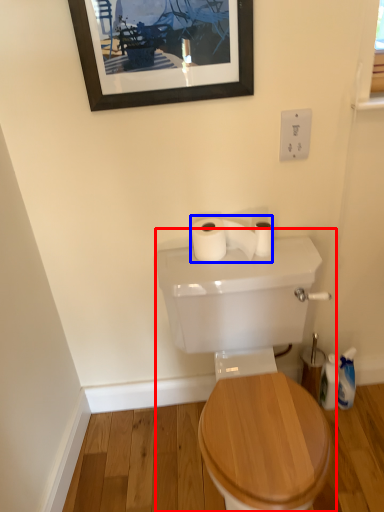
Question: Which object appears closest to the camera in this image, sink (highlighted by a red box) or toilet paper (highlighted by a blue box)?

Choices:
 (A) sink
 (B) toilet paper

Answer: (A)